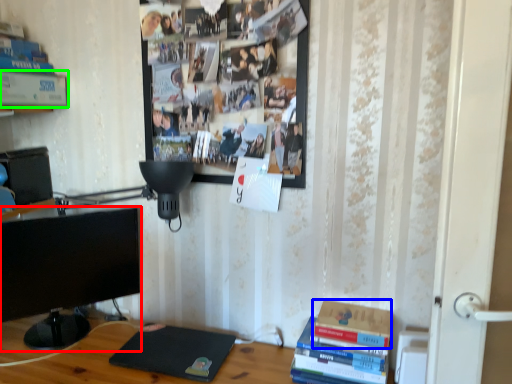
Question: Based on their relative distances, which object is farther from television (highlighted by a red box)? Choose from paperback book (highlighted by a blue box) and paperback book (highlighted by a green box).

Choices:
 (A) paperback book
 (B) paperback book

Answer: (A)